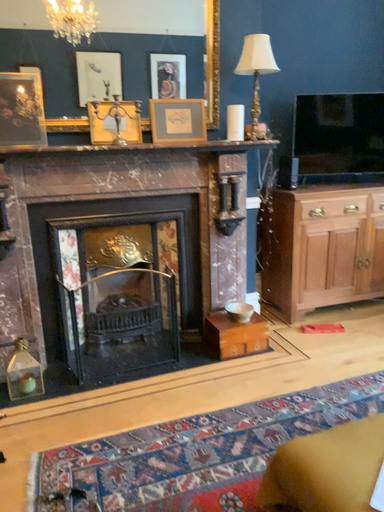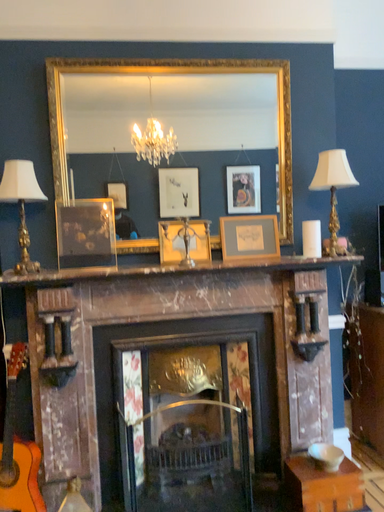
Question: Which way did the camera rotate in the video?

Choices:
 (A) rotated upward
 (B) rotated downward

Answer: (A)